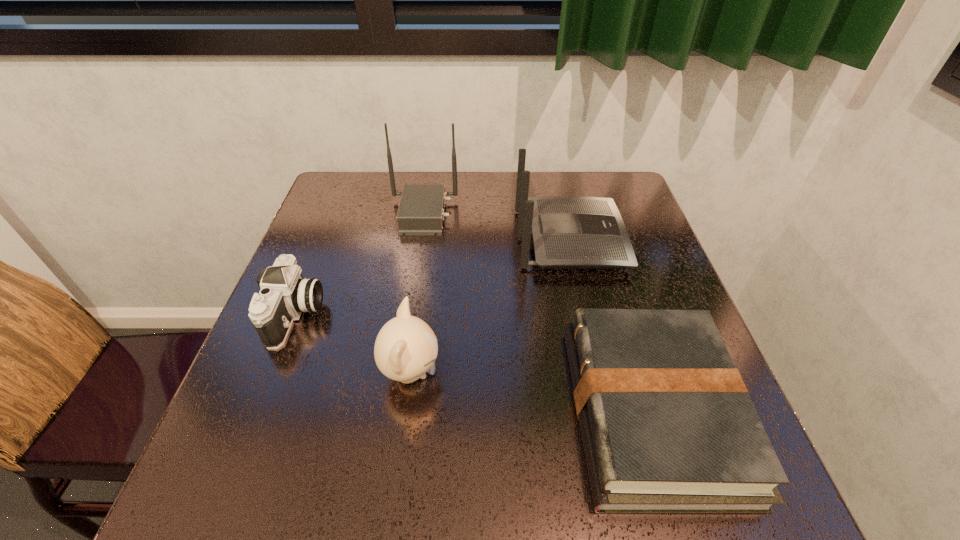
Identify the location of free point located 0.350m on the spine side of the shortest object. (379, 411).

Where is `free space located 0.100m on the spine side of the shortest object`? The image size is (960, 540). free space located 0.100m on the spine side of the shortest object is located at coordinates (518, 411).

Locate an element on the screen. object situated at the near edge is located at coordinates (667, 425).

Where is `object that is positioned at the left edge`? The image size is (960, 540). object that is positioned at the left edge is located at coordinates (285, 294).

You are a GUI agent. You are given a task and a screenshot of the screen. Output one action in this format:
    pyautogui.click(x=<x>, y=<y>)
    Task: Click on the router located in the right edge section of the desktop
    The height and width of the screenshot is (540, 960).
    Given the screenshot: What is the action you would take?
    pyautogui.click(x=569, y=232)

Locate an element on the screen. hardback book positioned at the right edge is located at coordinates (667, 425).

Locate an element on the screen. The image size is (960, 540). object located in the far right corner section of the desktop is located at coordinates (569, 232).

Identify the location of object present at the near right corner. (667, 425).

Find the location of `vacant space at the far edge of the desktop`. vacant space at the far edge of the desktop is located at coordinates (384, 205).

The image size is (960, 540). I want to click on vacant area at the left edge, so click(322, 383).